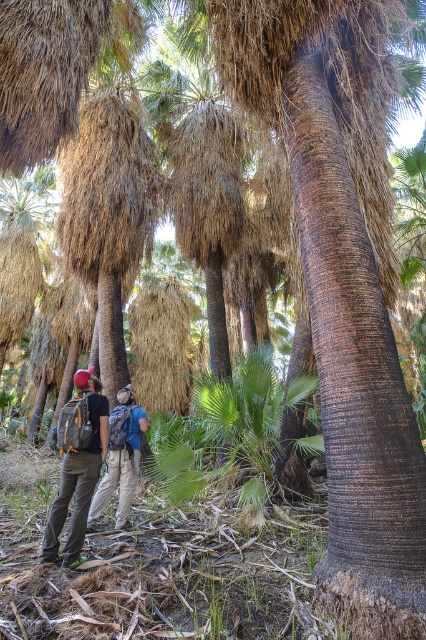
Question: Is matte gray backpack at center thinner than khaki pants at center?

Choices:
 (A) no
 (B) yes

Answer: (B)

Question: Can you confirm if matte gray backpack at center is bigger than khaki pants at center?

Choices:
 (A) yes
 (B) no

Answer: (B)

Question: Which object is farther from the camera taking this photo?

Choices:
 (A) khaki pants at center
 (B) matte gray backpack at center

Answer: (A)

Question: Can you confirm if matte gray backpack at center is positioned to the right of khaki pants at center?

Choices:
 (A) yes
 (B) no

Answer: (B)

Question: Which point is farther to the camera?

Choices:
 (A) matte gray backpack at center
 (B) khaki pants at center

Answer: (B)

Question: Which point is closer to the camera?

Choices:
 (A) khaki pants at center
 (B) matte gray backpack at center

Answer: (B)